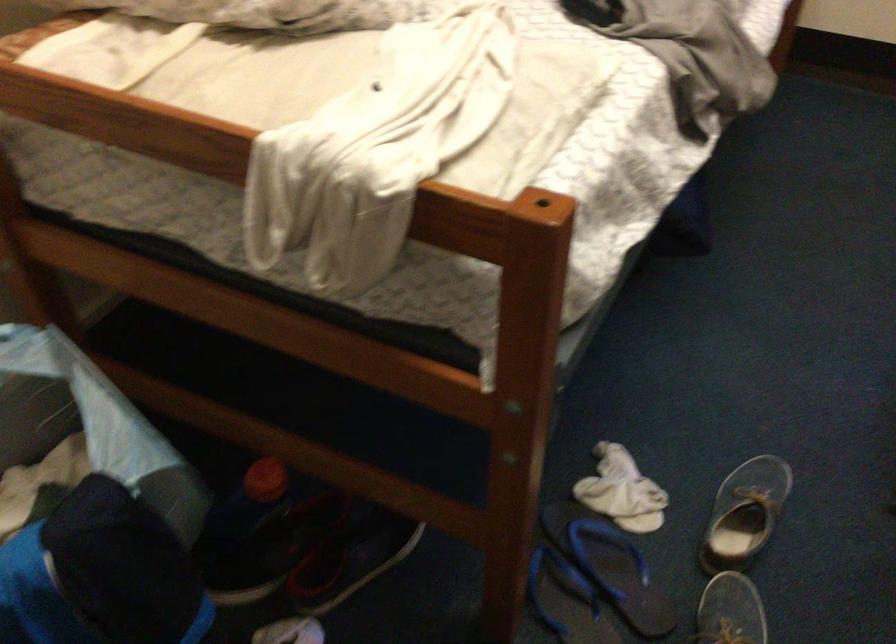
Where would you twist the red bottle cap? Please return your answer as a coordinate pair (x, y).

(264, 480)